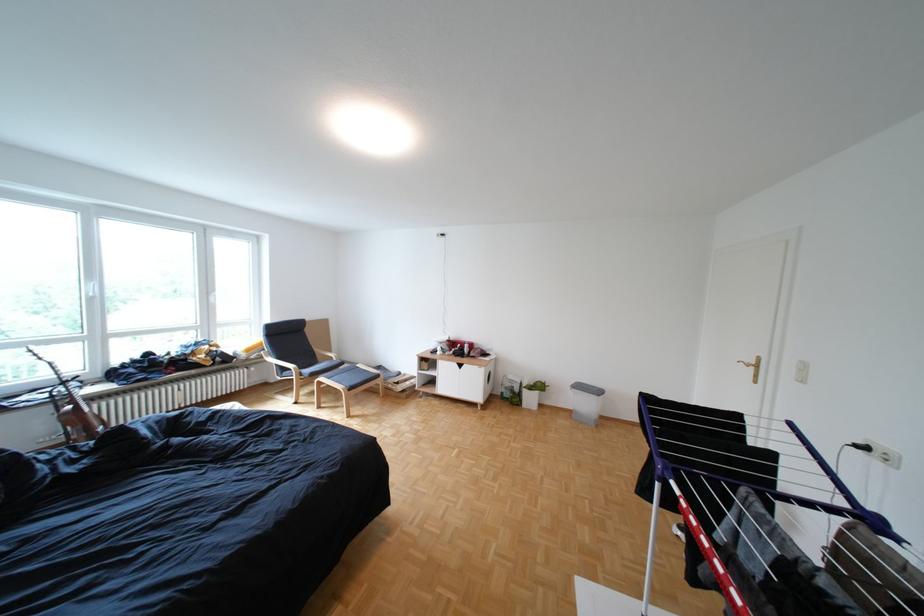
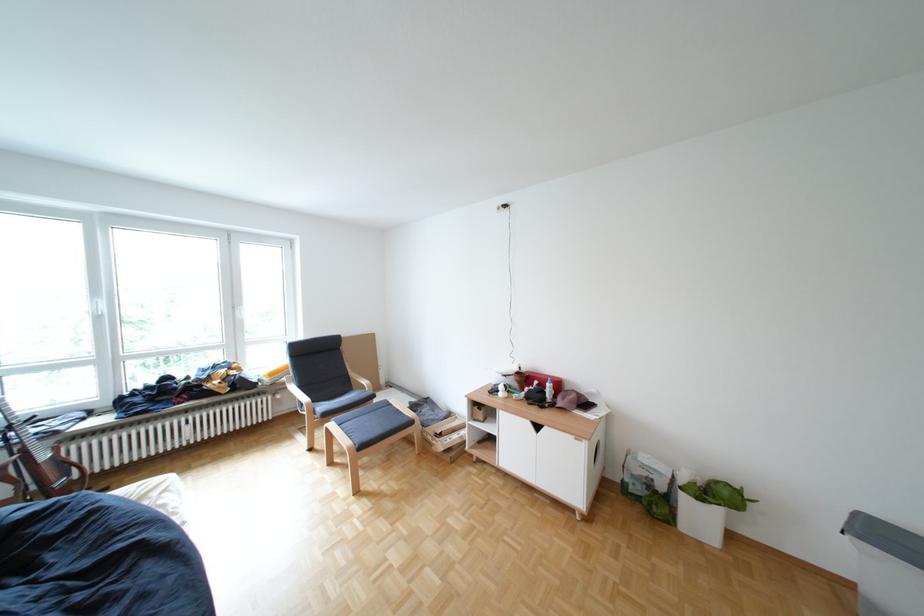
Where in the second image is the point corresponding to [358,363] from the first image?

(388, 397)